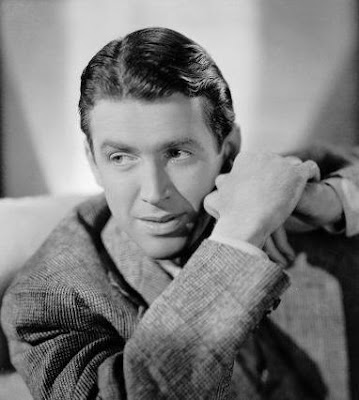
The width and height of the screenshot is (359, 400). Find the location of `seat`. seat is located at coordinates (25, 235).